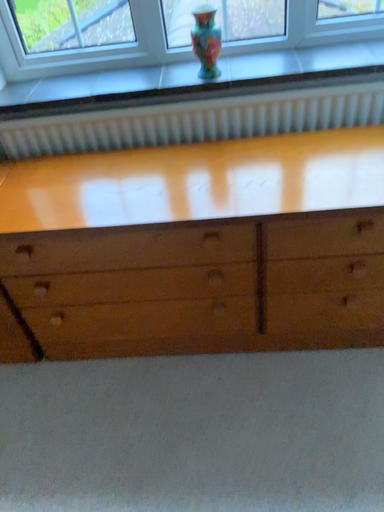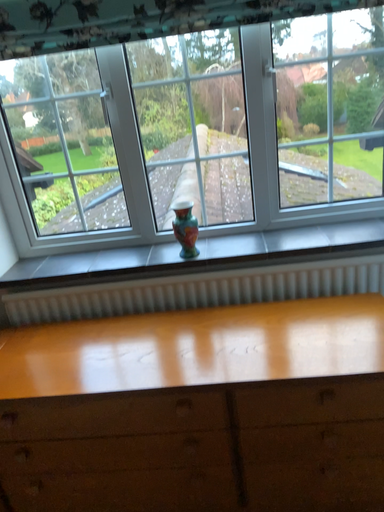
Question: Which way did the camera rotate in the video?

Choices:
 (A) rotated upward
 (B) rotated downward

Answer: (A)